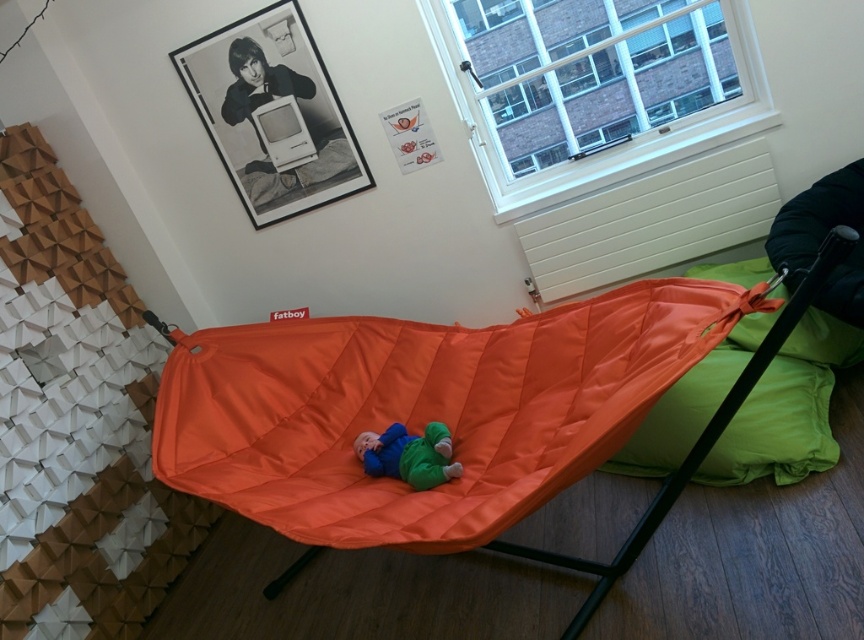
Question: Considering the real-world distances, which object is closest to the green fabric pillow at right?

Choices:
 (A) matte orange hammock at center
 (B) orange fabric bean bag chair at right
 (C) green fabric pillow at lower right

Answer: (B)

Question: Which object is farther from the camera taking this photo?

Choices:
 (A) orange quilted fabric hammock at center
 (B) green fabric pillow at lower right

Answer: (B)

Question: Which point appears farthest from the camera in this image?

Choices:
 (A) (797, 449)
 (B) (802, 349)
 (C) (727, 412)
 (D) (402, 449)

Answer: (B)

Question: Considering the relative positions of orange quilted fabric hammock at center and green fabric pillow at right in the image provided, where is orange quilted fabric hammock at center located with respect to green fabric pillow at right?

Choices:
 (A) below
 (B) above

Answer: (A)

Question: In this image, where is orange quilted fabric hammock at center located relative to green fabric pillow at lower right?

Choices:
 (A) above
 (B) below

Answer: (A)

Question: In this image, where is green fabric pillow at right located relative to matte orange hammock at center?

Choices:
 (A) below
 (B) above

Answer: (B)